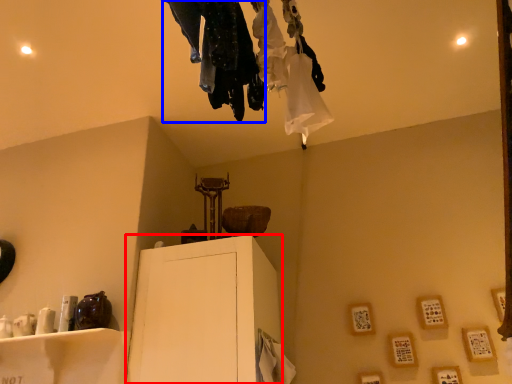
Question: Among these objects, which one is nearest to the camera, furniture (highlighted by a red box) or clothing (highlighted by a blue box)?

Choices:
 (A) furniture
 (B) clothing

Answer: (B)